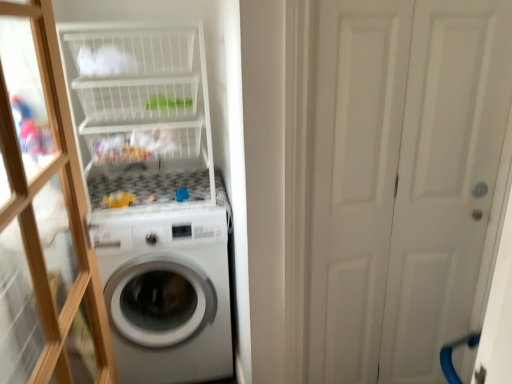
Question: Is transparent glass door at left aimed at white matte door at right?

Choices:
 (A) no
 (B) yes

Answer: (B)

Question: Considering the relative sizes of transparent glass door at left and white matte door at right in the image provided, is transparent glass door at left thinner than white matte door at right?

Choices:
 (A) no
 (B) yes

Answer: (A)

Question: Is transparent glass door at left shorter than white matte door at right?

Choices:
 (A) no
 (B) yes

Answer: (B)

Question: Could white matte door at right be considered to be inside transparent glass door at left?

Choices:
 (A) no
 (B) yes

Answer: (A)

Question: Is transparent glass door at left taller than white matte door at right?

Choices:
 (A) yes
 (B) no

Answer: (B)

Question: From a real-world perspective, is transparent glass door at left positioned above or below white matte door at right?

Choices:
 (A) below
 (B) above

Answer: (B)

Question: Do you think transparent glass door at left is within white matte door at right, or outside of it?

Choices:
 (A) inside
 (B) outside

Answer: (B)

Question: Does point (96, 329) appear closer or farther from the camera than point (372, 163)?

Choices:
 (A) farther
 (B) closer

Answer: (B)

Question: Considering the positions of transparent glass door at left and white matte door at right in the image, is transparent glass door at left taller or shorter than white matte door at right?

Choices:
 (A) tall
 (B) short

Answer: (B)

Question: Is point (144, 170) closer or farther from the camera than point (153, 256)?

Choices:
 (A) closer
 (B) farther

Answer: (B)

Question: Is white wire basket at upper left inside the boundaries of white glossy washing machine at center, or outside?

Choices:
 (A) inside
 (B) outside

Answer: (B)

Question: Relative to white glossy washing machine at center, is white wire basket at upper left in front or behind?

Choices:
 (A) behind
 (B) front

Answer: (B)

Question: From a real-world perspective, is white wire basket at upper left physically located above or below white glossy washing machine at center?

Choices:
 (A) above
 (B) below

Answer: (A)

Question: From their relative heights in the image, would you say white matte door at right is taller or shorter than transparent glass door at left?

Choices:
 (A) short
 (B) tall

Answer: (B)

Question: In the image, is white matte door at right positioned in front of or behind transparent glass door at left?

Choices:
 (A) front
 (B) behind

Answer: (B)